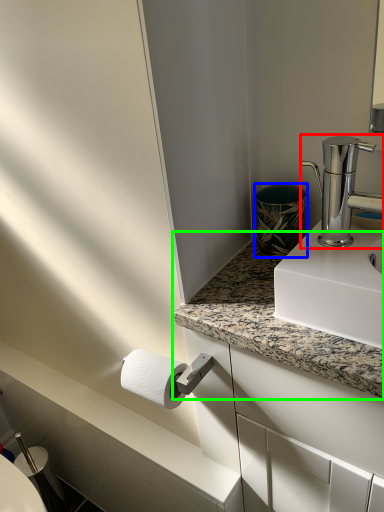
Question: Which object is the farthest from tap (highlighted by a red box)? Choose among these: appliance (highlighted by a blue box) or countertop (highlighted by a green box).

Choices:
 (A) appliance
 (B) countertop

Answer: (B)